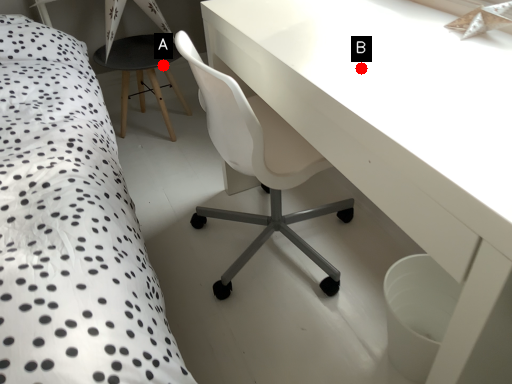
Question: Two points are circled on the image, labeled by A and B beside each circle. Which of the following is the farthest from the observer?

Choices:
 (A) A is further
 (B) B is further

Answer: (A)